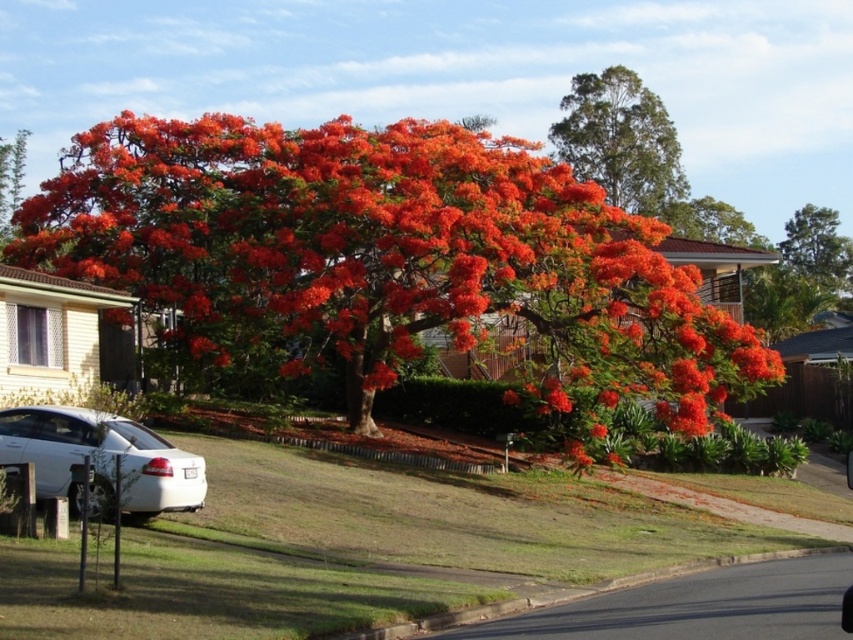
Measure the distance between vivid orange foliage at upper right and camera.

A distance of 56.45 meters exists between vivid orange foliage at upper right and camera.

This screenshot has height=640, width=853. I want to click on vivid orange foliage at upper right, so click(x=619, y=140).

Between point (347, 240) and point (821, 289), which one is positioned behind?

The point (821, 289) is behind.

Does bright orange blossoms at center appear on the right side of orange matte tree at right?

Incorrect, bright orange blossoms at center is not on the right side of orange matte tree at right.

Between point (161, 273) and point (772, 275), which one is positioned in front?

Positioned in front is point (161, 273).

The width and height of the screenshot is (853, 640). In order to click on bright orange blossoms at center in this screenshot , I will do `click(387, 256)`.

Looking at this image, which is more to the right, orange matte tree at right or orange vibrant leaves at center?

From the viewer's perspective, orange matte tree at right appears more on the right side.

Can you confirm if orange matte tree at right is positioned to the left of orange vibrant leaves at center?

Incorrect, orange matte tree at right is not on the left side of orange vibrant leaves at center.

Between point (788, 305) and point (0, 140), which one is positioned behind?

The point (0, 140) is more distant.

Identify the location of orange matte tree at right. The height and width of the screenshot is (640, 853). (785, 300).